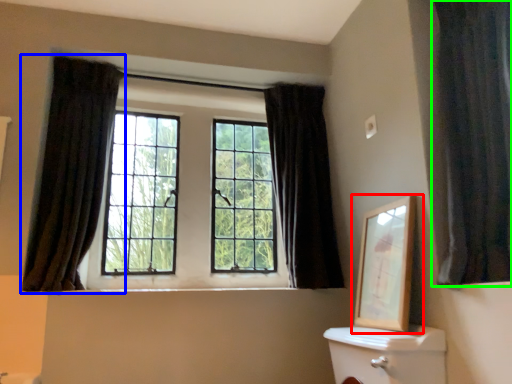
Question: Based on their relative distances, which object is farther from picture frame (highlighted by a red box)? Choose from curtain (highlighted by a blue box) and curtain (highlighted by a green box).

Choices:
 (A) curtain
 (B) curtain

Answer: (A)